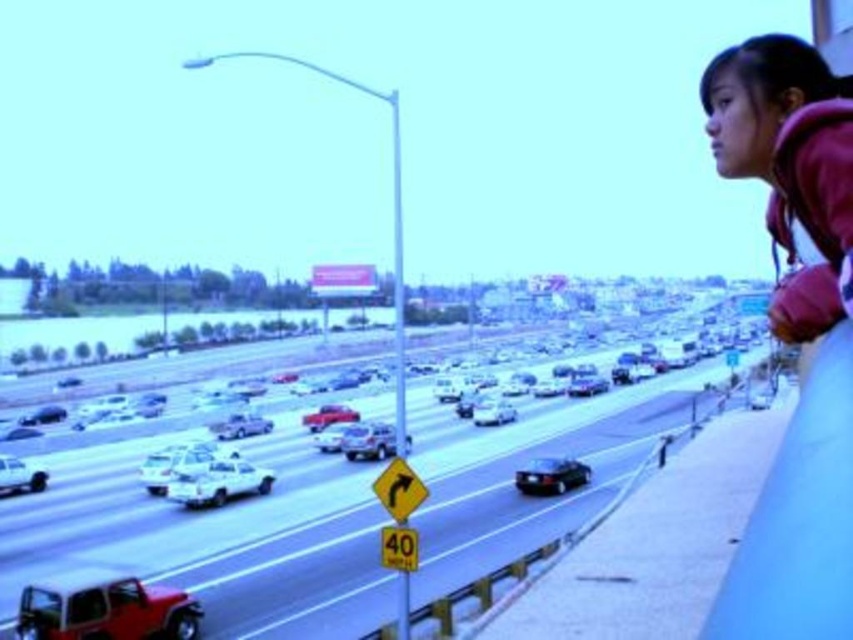
You are a pedestrian standing on the bridge and see the matte red jeep at lower left and the shiny black sedan at center. Which vehicle is closer to the left edge of the bridge?

The matte red jeep at lower left is positioned on the left side of the shiny black sedan at center, so it is closer to the left edge of the bridge.

You are standing at the point marked by the coordinates point (x=793, y=332) in the image. Looking around, you see the purple fleece jacket at upper right. Which direction should you move to get closer to the highway traffic below?

The point (x=793, y=332) corresponds to the purple fleece jacket at upper right. To get closer to the highway traffic below, you should move downward from the purple fleece jacket at upper right.

Consider the image. You are a driver who wants to know which vehicle is taller between the metallic silver cars at center and the matte red jeep at lower left. Can you determine which one is taller based on the scene?

The metallic silver cars at center is much taller than the matte red jeep at lower left.